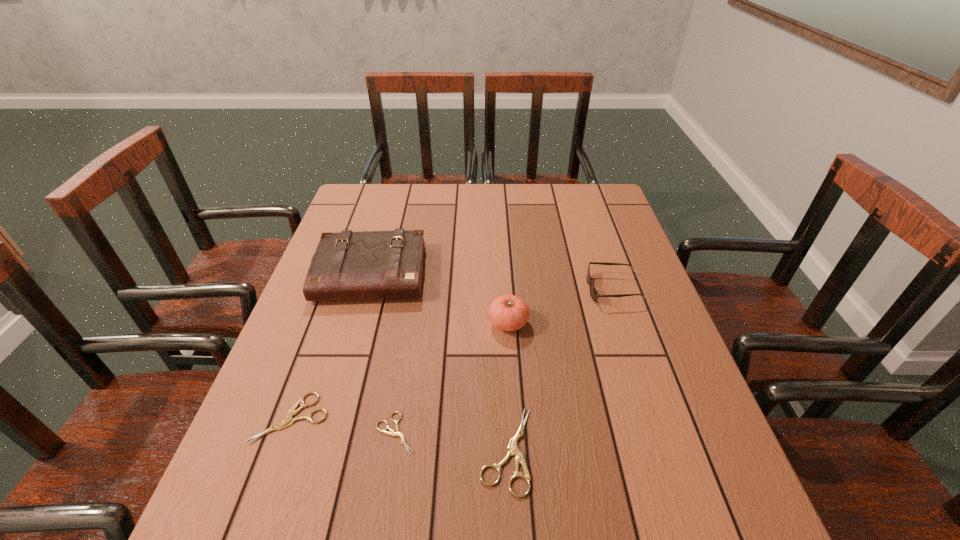
Find the location of a particular element. The width and height of the screenshot is (960, 540). object that is at the near left corner is located at coordinates (288, 421).

In the image, there is a desktop. Identify the location of blank space at the far edge. This screenshot has height=540, width=960. (492, 221).

In the image, there is a desktop. In order to click on vacant space at the near edge in this screenshot , I will do `click(333, 448)`.

In the image, there is a desktop. Identify the location of vacant space at the left edge. The image size is (960, 540). (310, 303).

This screenshot has width=960, height=540. Find the location of `vacant space at the right edge`. vacant space at the right edge is located at coordinates (635, 289).

At what (x,y) coordinates should I click in order to perform the action: click on free space between the rightmost shears and the shortest object. Please return your answer as a coordinate pair (x, y). The image size is (960, 540). Looking at the image, I should click on (451, 442).

This screenshot has height=540, width=960. What are the coordinates of `empty space between the hardback book and the rightmost object` in the screenshot? It's located at [x=492, y=281].

Locate an element on the screen. This screenshot has width=960, height=540. empty space between the hardback book and the third farthest object is located at coordinates (440, 298).

Identify the location of free spot between the hardback book and the shortest shears. Image resolution: width=960 pixels, height=540 pixels. (383, 353).

At what (x,y) coordinates should I click in order to perform the action: click on vacant area that lies between the fifth tallest object and the hardback book. Please return your answer as a coordinate pair (x, y). This screenshot has height=540, width=960. Looking at the image, I should click on (331, 346).